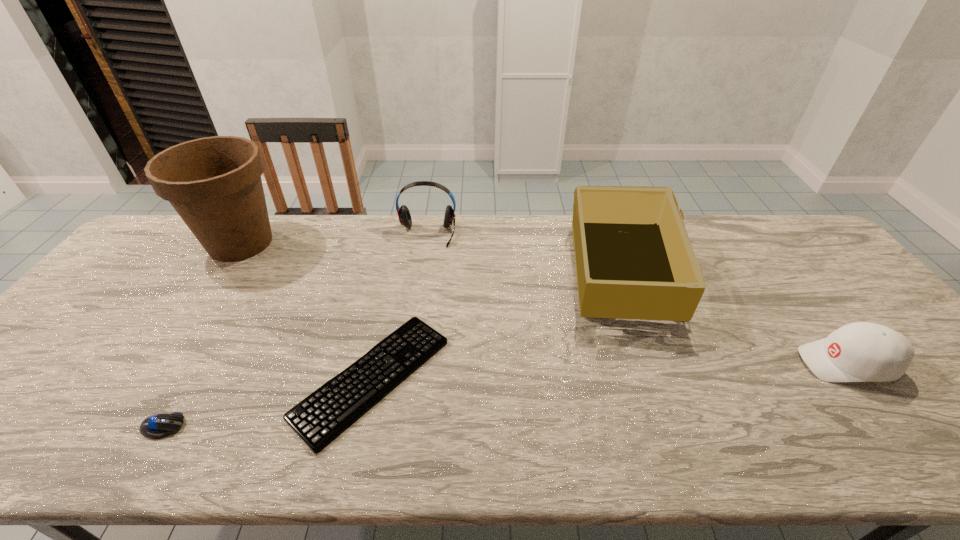
The width and height of the screenshot is (960, 540). I want to click on object positioned at the right edge, so click(x=862, y=351).

Where is `vacant region at the far edge of the desktop`? The width and height of the screenshot is (960, 540). vacant region at the far edge of the desktop is located at coordinates (769, 251).

This screenshot has width=960, height=540. In the image, there is a desktop. Identify the location of free region at the near edge. (175, 447).

This screenshot has height=540, width=960. In the image, there is a desktop. Identify the location of free space at the left edge. (115, 305).

Where is `vacant space at the right edge`? Image resolution: width=960 pixels, height=540 pixels. vacant space at the right edge is located at coordinates (850, 295).

The width and height of the screenshot is (960, 540). Find the location of `vacant position at the far left corner of the desktop`. vacant position at the far left corner of the desktop is located at coordinates pos(183,246).

Locate an element on the screen. vacant area between the headset and the tallest object is located at coordinates point(334,239).

The width and height of the screenshot is (960, 540). In order to click on vacant space that is in between the box and the tallest object in this screenshot , I will do `click(431, 256)`.

At what (x,y) coordinates should I click in order to perform the action: click on empty space that is in between the box and the baseball cap. Please return your answer as a coordinate pair (x, y). Image resolution: width=960 pixels, height=540 pixels. Looking at the image, I should click on (733, 316).

Find the location of a particular element. The image size is (960, 540). blank region between the tallest object and the headset is located at coordinates (334, 239).